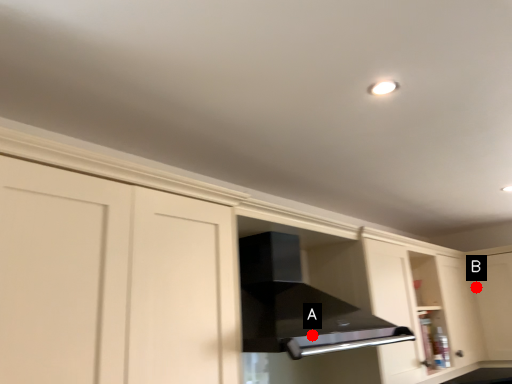
Question: Two points are circled on the image, labeled by A and B beside each circle. Which point is closer to the camera taking this photo?

Choices:
 (A) A is closer
 (B) B is closer

Answer: (A)